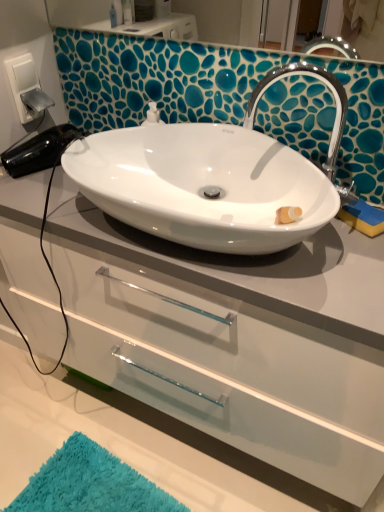
Question: Is chrome metallic faucet at upper right smaller than white glossy sink at center?

Choices:
 (A) yes
 (B) no

Answer: (A)

Question: From the image's perspective, is chrome metallic faucet at upper right located beneath white glossy sink at center?

Choices:
 (A) yes
 (B) no

Answer: (B)

Question: Can you confirm if chrome metallic faucet at upper right is thinner than white glossy sink at center?

Choices:
 (A) no
 (B) yes

Answer: (B)

Question: Does chrome metallic faucet at upper right turn towards white glossy sink at center?

Choices:
 (A) yes
 (B) no

Answer: (A)

Question: Considering the relative sizes of chrome metallic faucet at upper right and white glossy sink at center in the image provided, is chrome metallic faucet at upper right bigger than white glossy sink at center?

Choices:
 (A) yes
 (B) no

Answer: (B)

Question: In terms of width, does white glossy sink at center look wider or thinner when compared to chrome metallic faucet at upper right?

Choices:
 (A) wide
 (B) thin

Answer: (A)

Question: Would you say white glossy sink at center is to the left or to the right of chrome metallic faucet at upper right in the picture?

Choices:
 (A) right
 (B) left

Answer: (B)

Question: Is point (216, 181) closer or farther from the camera than point (266, 87)?

Choices:
 (A) farther
 (B) closer

Answer: (A)

Question: Is white glossy sink at center in front of or behind chrome metallic faucet at upper right in the image?

Choices:
 (A) behind
 (B) front

Answer: (B)

Question: From their relative heights in the image, would you say white glossy cabinet at center is taller or shorter than turquoise shaggy bath mat at lower left?

Choices:
 (A) tall
 (B) short

Answer: (A)

Question: Considering the positions of white glossy cabinet at center and turquoise shaggy bath mat at lower left in the image, is white glossy cabinet at center wider or thinner than turquoise shaggy bath mat at lower left?

Choices:
 (A) thin
 (B) wide

Answer: (A)

Question: From the image's perspective, is white glossy cabinet at center above or below turquoise shaggy bath mat at lower left?

Choices:
 (A) above
 (B) below

Answer: (A)

Question: Is point (97, 333) positioned closer to the camera than point (77, 494)?

Choices:
 (A) closer
 (B) farther

Answer: (A)

Question: Would you say white glossy sink at center is inside or outside turquoise shaggy bath mat at lower left?

Choices:
 (A) inside
 (B) outside

Answer: (B)

Question: Relative to turquoise shaggy bath mat at lower left, is white glossy sink at center in front or behind?

Choices:
 (A) front
 (B) behind

Answer: (A)